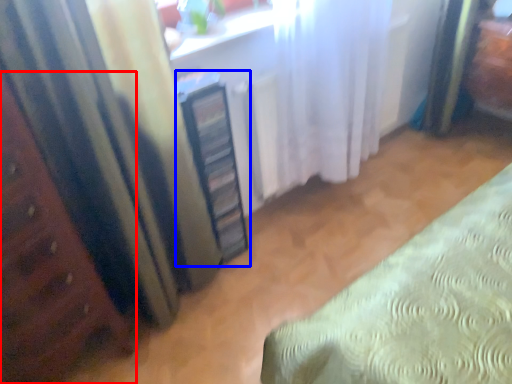
Question: Which point is further to the camera, furniture (highlighted by a red box) or cabinetry (highlighted by a blue box)?

Choices:
 (A) furniture
 (B) cabinetry

Answer: (B)